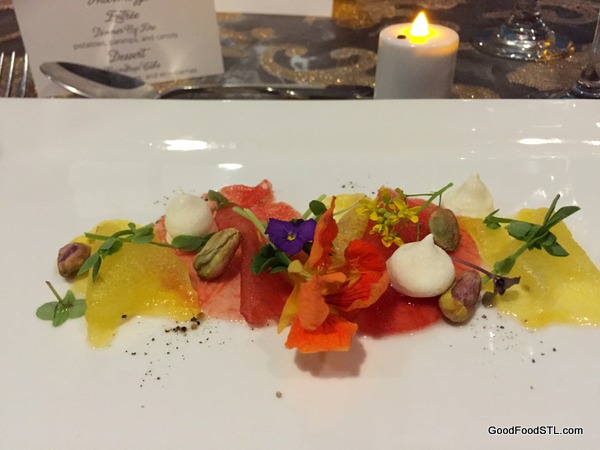
Locate an element on the screen. The height and width of the screenshot is (450, 600). fake candle is located at coordinates (408, 55).